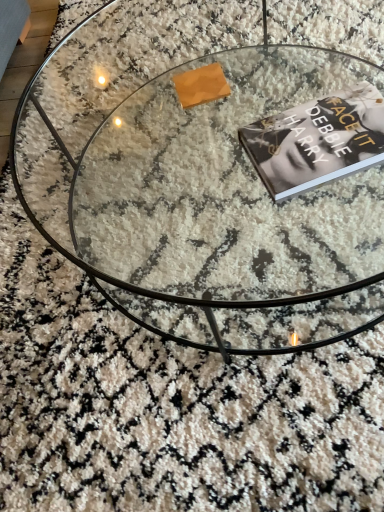
Question: From the image's perspective, relative to transparent glass coffee table at center, is black matte book at center above or below?

Choices:
 (A) above
 (B) below

Answer: (B)

Question: From a real-world perspective, relative to transparent glass coffee table at center, is black matte book at center vertically above or below?

Choices:
 (A) above
 (B) below

Answer: (A)

Question: From their relative heights in the image, would you say black matte book at center is taller or shorter than transparent glass coffee table at center?

Choices:
 (A) tall
 (B) short

Answer: (B)

Question: Choose the correct answer: Is transparent glass coffee table at center inside black matte book at center or outside it?

Choices:
 (A) outside
 (B) inside

Answer: (A)

Question: From a real-world perspective, is transparent glass coffee table at center positioned above or below black matte book at center?

Choices:
 (A) below
 (B) above

Answer: (A)

Question: Relative to black matte book at center, is transparent glass coffee table at center in front or behind?

Choices:
 (A) front
 (B) behind

Answer: (A)

Question: Looking at the image, does transparent glass coffee table at center seem bigger or smaller compared to black matte book at center?

Choices:
 (A) big
 (B) small

Answer: (A)